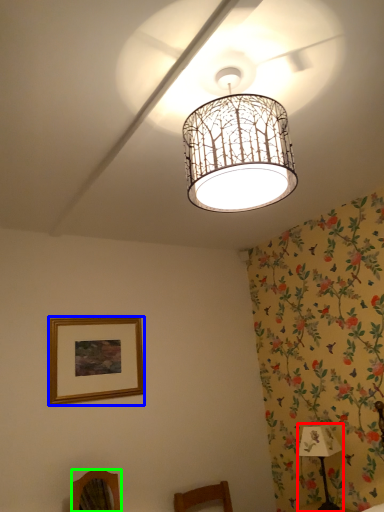
Question: Which is farther away from table lamp (highlighted by a red box)? picture frame (highlighted by a blue box) or furniture (highlighted by a green box)?

Choices:
 (A) picture frame
 (B) furniture

Answer: (A)